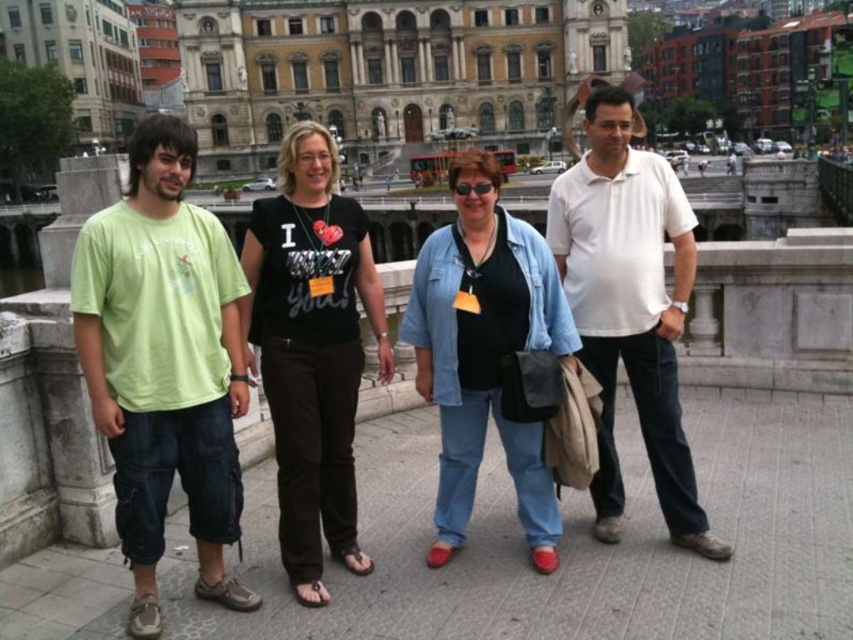
Does point (277, 273) come closer to viewer compared to point (474, 168)?

Yes, it is.

Does black cotton t-shirt at center lie in front of denim jacket at center?

Yes, black cotton t-shirt at center is closer to the viewer.

Is point (251, 256) in front of point (552, 300)?

That is False.

In order to click on black cotton t-shirt at center in this screenshot , I will do `click(312, 349)`.

Between green cotton t-shirt at left and black cotton t-shirt at center, which one has more height?

black cotton t-shirt at center

Which is in front, point (157, 442) or point (279, 516)?

Point (157, 442) is more forward.

Is point (149, 540) more distant than point (248, 256)?

No, it is not.

This screenshot has width=853, height=640. What are the coordinates of `green cotton t-shirt at left` in the screenshot? It's located at (164, 364).

Between black cotton t-shirt at center and white cotton polo shirt at center, which one appears on the left side from the viewer's perspective?

From the viewer's perspective, black cotton t-shirt at center appears more on the left side.

Between point (293, 532) and point (607, 209), which one is positioned behind?

Positioned behind is point (607, 209).

Find the location of a particular element. The image size is (853, 640). black cotton t-shirt at center is located at coordinates (312, 349).